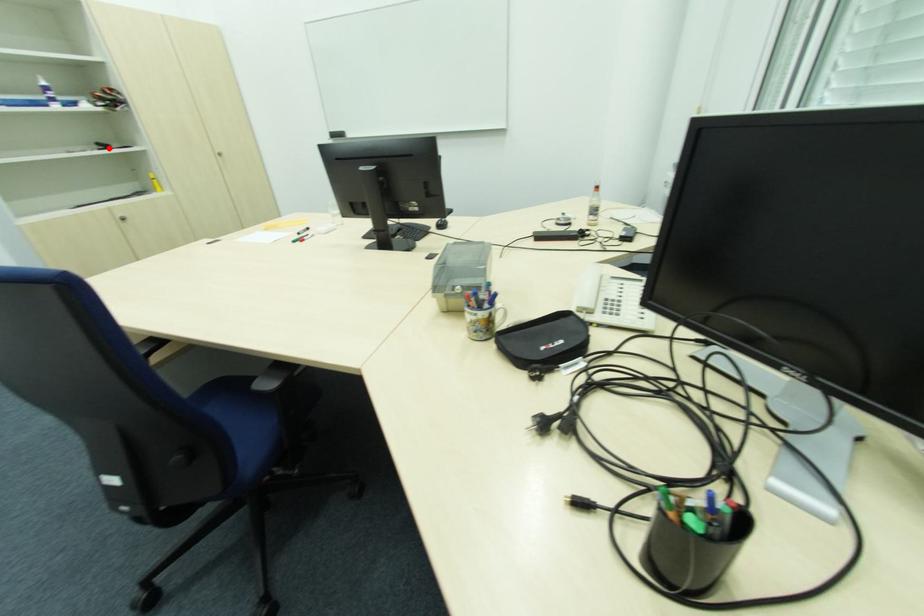
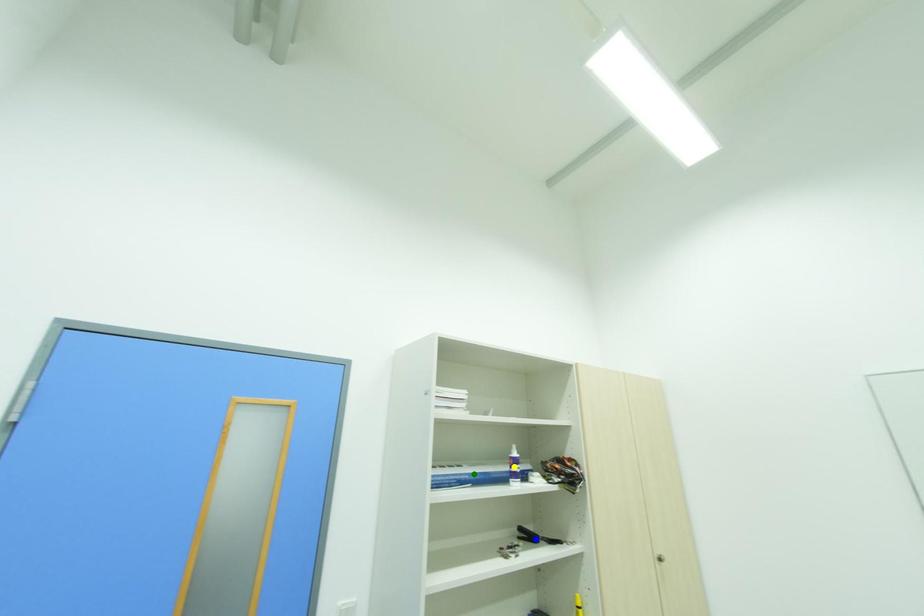
Question: I am providing you with two images of the same scene from different viewpoints. A red point is marked on the first image. You are given multiple points on the second image. Which point in image 2 represents the same 3d spot as the red point in image 1?

Choices:
 (A) blue point
 (B) yellow point
 (C) green point

Answer: (A)